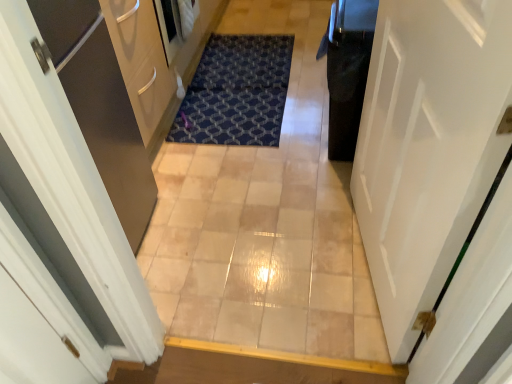
Locate an element on the screen. Image resolution: width=512 pixels, height=384 pixels. free space to the left of white glossy door at right is located at coordinates (270, 260).